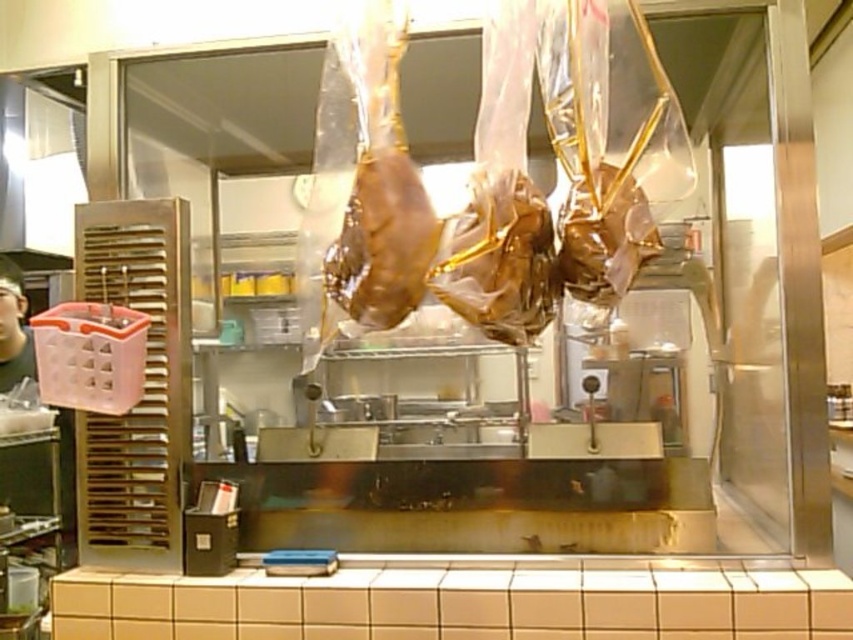
Question: Is shiny gold meat at center above gold foil wrapped meat at center?

Choices:
 (A) yes
 (B) no

Answer: (B)

Question: Which is nearer to the shiny gold meat at center?

Choices:
 (A) brown glossy meat at center
 (B) gold foil wrapped meat at center

Answer: (B)

Question: Which point is farther to the camera?

Choices:
 (A) shiny gold meat at center
 (B) gold foil wrapped meat at center

Answer: (B)

Question: Does shiny gold meat at center appear over brown glossy meat at center?

Choices:
 (A) no
 (B) yes

Answer: (A)

Question: Among these points, which one is nearest to the camera?

Choices:
 (A) (509, 304)
 (B) (630, 216)

Answer: (A)

Question: Where is shiny gold meat at center located in relation to gold foil wrapped meat at center in the image?

Choices:
 (A) below
 (B) above

Answer: (A)